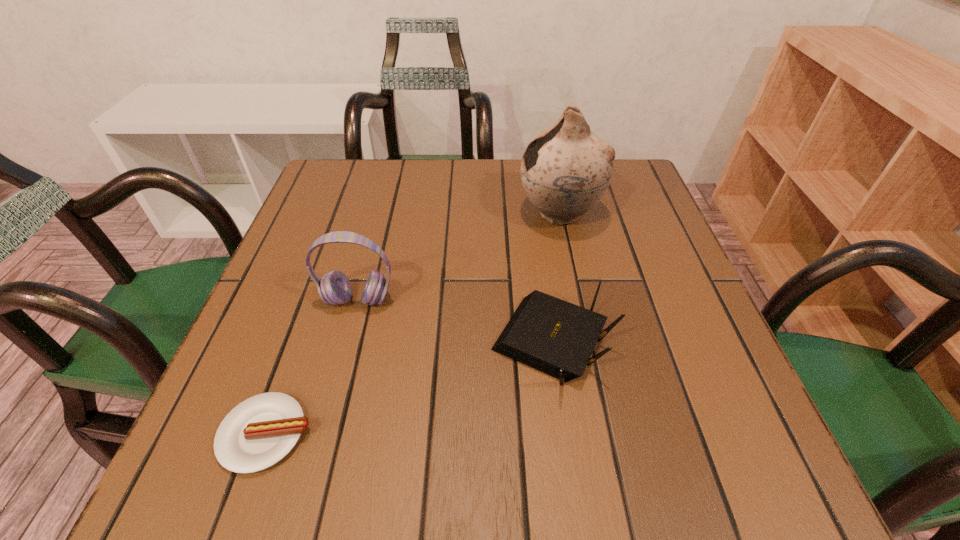
Find the location of a particular element. The width and height of the screenshot is (960, 540). vacant space at the left edge of the desktop is located at coordinates (311, 220).

The image size is (960, 540). Find the location of `vacant space at the right edge of the desktop`. vacant space at the right edge of the desktop is located at coordinates (662, 298).

Locate an element on the screen. The width and height of the screenshot is (960, 540). vacant space at the near right corner of the desktop is located at coordinates (676, 467).

At what (x,y) coordinates should I click in order to perform the action: click on free spot between the sausage and the headset. Please return your answer as a coordinate pair (x, y). Looking at the image, I should click on (312, 367).

This screenshot has height=540, width=960. Identify the location of empty location between the sausage and the farthest object. (413, 323).

The height and width of the screenshot is (540, 960). Identify the location of free space between the farthest object and the shortest object. [413, 323].

Locate an element on the screen. This screenshot has height=540, width=960. free space between the shortest object and the second shortest object is located at coordinates (409, 389).

Locate an element on the screen. This screenshot has width=960, height=540. free area in between the headset and the tallest object is located at coordinates (459, 257).

At what (x,y) coordinates should I click in order to perform the action: click on vacant area between the farthest object and the shortest object. Please return your answer as a coordinate pair (x, y). The height and width of the screenshot is (540, 960). Looking at the image, I should click on (413, 323).

At what (x,y) coordinates should I click in order to perform the action: click on vacant point located between the farthest object and the router. Please return your answer as a coordinate pair (x, y). This screenshot has height=540, width=960. Looking at the image, I should click on (556, 279).